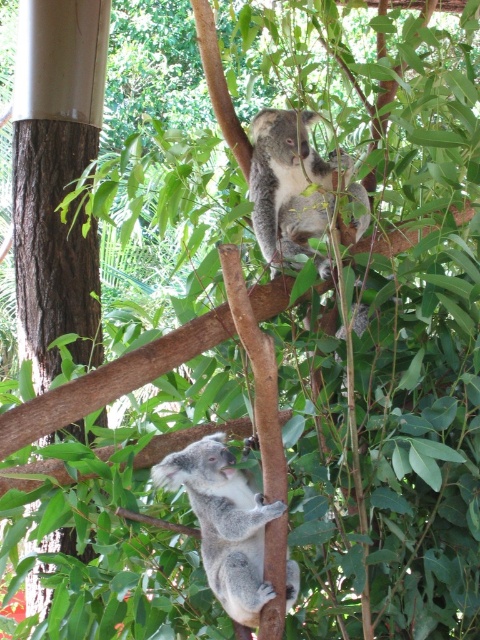
Question: Among these objects, which one is farthest from the camera?

Choices:
 (A) fuzzy gray koala at upper center
 (B) fuzzy gray koala at lower center

Answer: (A)

Question: Among these objects, which one is nearest to the camera?

Choices:
 (A) fuzzy gray koala at lower center
 (B) fuzzy gray koala at upper center

Answer: (A)

Question: Does fuzzy gray koala at lower center have a smaller size compared to fuzzy gray koala at upper center?

Choices:
 (A) no
 (B) yes

Answer: (B)

Question: Can you confirm if fuzzy gray koala at lower center is positioned to the left of fuzzy gray koala at upper center?

Choices:
 (A) yes
 (B) no

Answer: (A)

Question: Is fuzzy gray koala at lower center closer to camera compared to fuzzy gray koala at upper center?

Choices:
 (A) no
 (B) yes

Answer: (B)